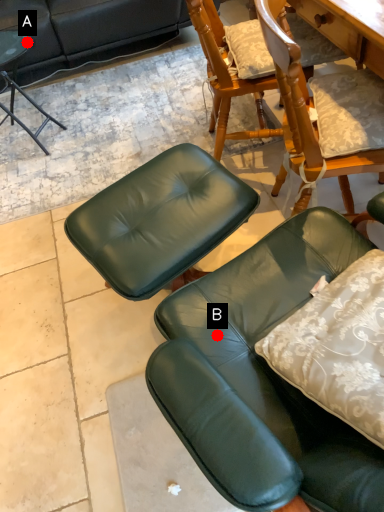
Question: Two points are circled on the image, labeled by A and B beside each circle. Which point is farther from the camera taking this photo?

Choices:
 (A) A is further
 (B) B is further

Answer: (A)